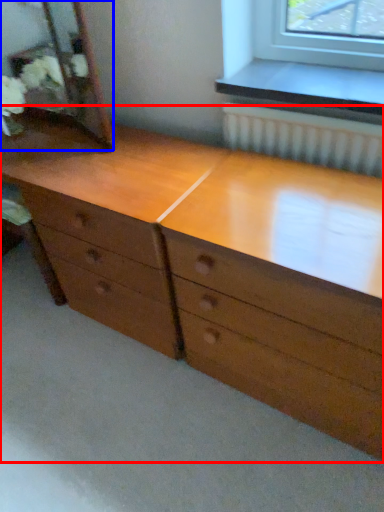
Question: Which object appears farthest to the camera in this image, chest of drawers (highlighted by a red box) or mirror (highlighted by a blue box)?

Choices:
 (A) chest of drawers
 (B) mirror

Answer: (B)